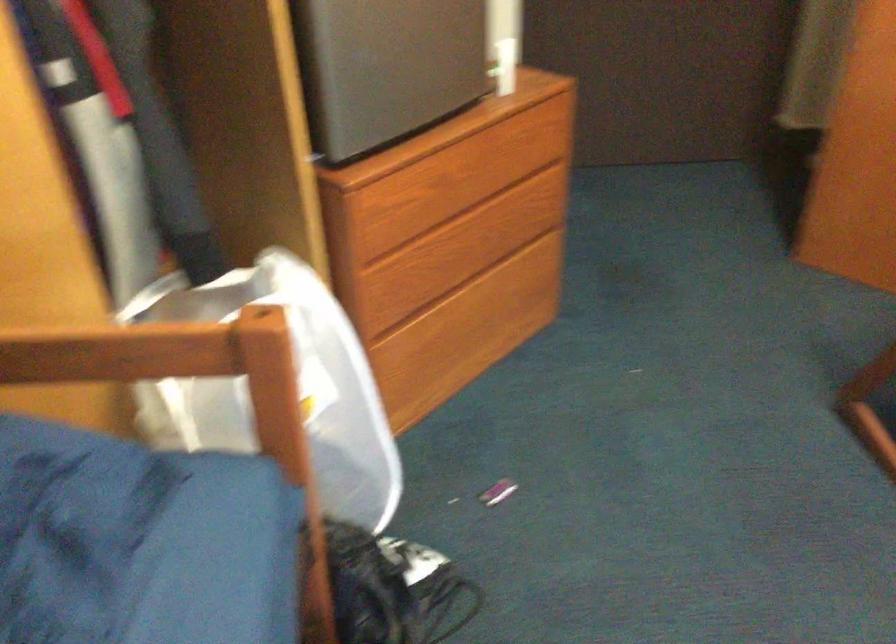
What do you see at coordinates (73, 529) in the screenshot?
I see `the chair sitting surface` at bounding box center [73, 529].